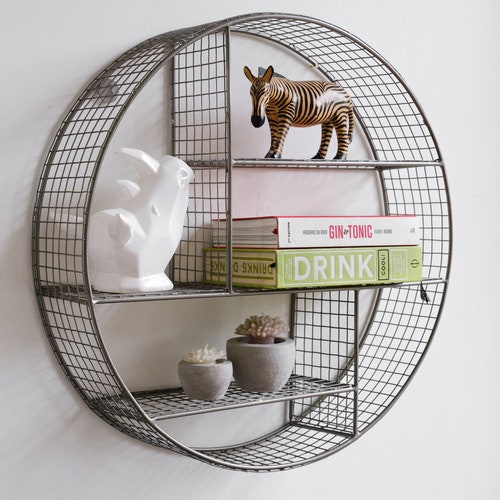
You are a GUI agent. You are given a task and a screenshot of the screen. Output one action in this format:
    pyautogui.click(x=<x>, y=<y>)
    Task: Click on the round wall shelf
    The image size is (500, 500).
    Given the screenshot: What is the action you would take?
    pyautogui.click(x=256, y=469)